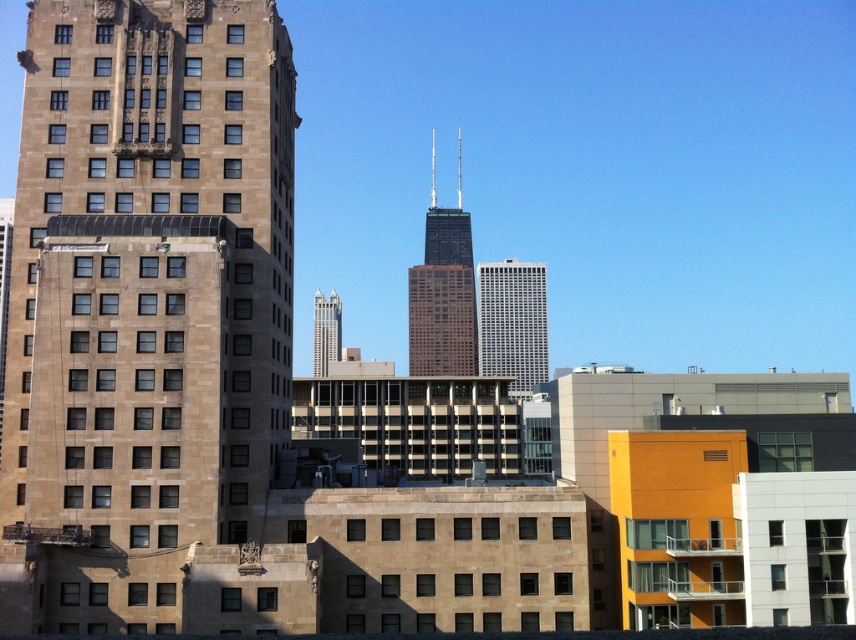
Based on the photo, you are a drone operator trying to navigate your drone through the city. Your drone is currently at the coordinates given in the image. You need to fly towards the brown glassy tower at center. What direction should you fly to reach it?

Since the brown glassy tower at center is located at coordinates point (x=443, y=296), you should fly towards those coordinates to reach it.

You are a city planner evaluating the urban layout. You notice the white glass building at center and the matte glass skyscraper at center. Which of these two buildings has a larger footprint in the cityscape?

The white glass building at center has a larger footprint than the matte glass skyscraper at center because it is bigger in size.

You are a drone operator trying to fly a drone between the brown glassy tower at center and the matte glass skyscraper at center. The drone has a wingspan of 2 meters. Can the drone safely navigate the space between them?

The distance between the brown glassy tower at center and the matte glass skyscraper at center is 30.09 meters, which is more than enough for the drone with a 2 meter wingspan to safely navigate between them.